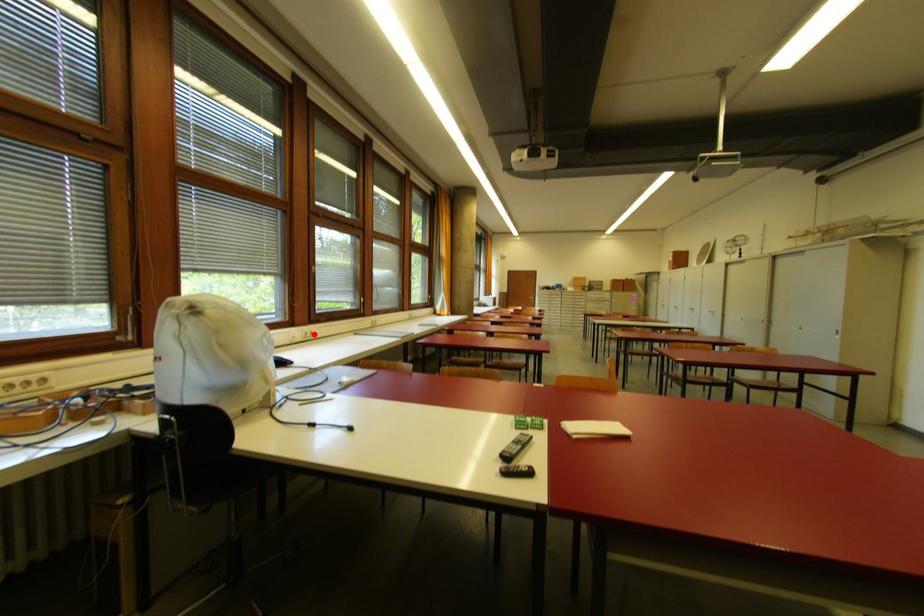
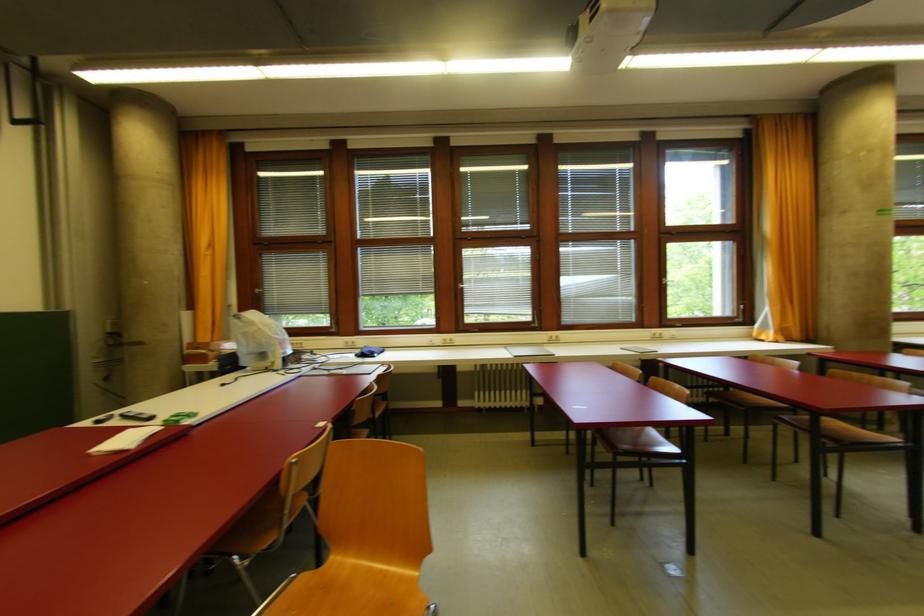
In the second image, find the point that corresponds to the highlighted location in the first image.

(454, 342)